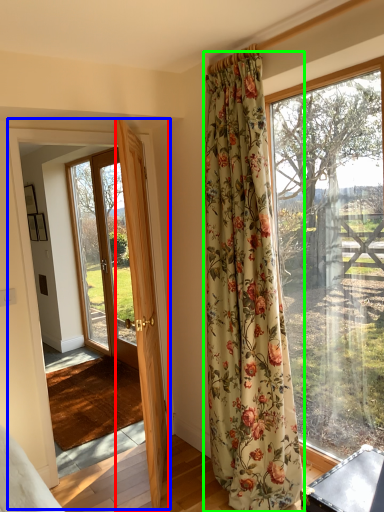
Question: Considering the real-world distances, which object is closest to door (highlighted by a red box)? barn door (highlighted by a blue box) or curtain (highlighted by a green box).

Choices:
 (A) barn door
 (B) curtain

Answer: (A)